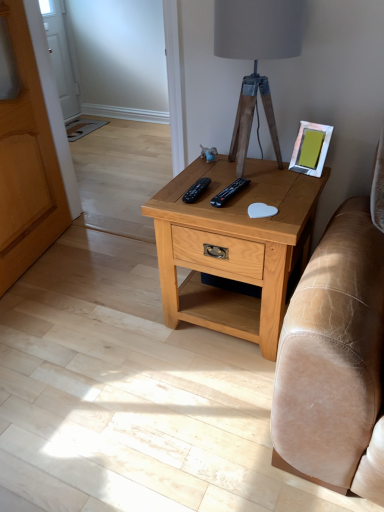
The width and height of the screenshot is (384, 512). I want to click on free space above light brown wood nightstand at center (from a real-world perspective), so click(258, 187).